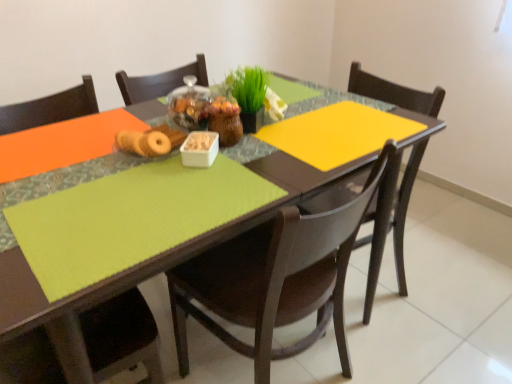
Question: Does white plastic container at center have a smaller size compared to green matte grass at center?

Choices:
 (A) yes
 (B) no

Answer: (A)

Question: Would you say white plastic container at center is outside green matte grass at center?

Choices:
 (A) yes
 (B) no

Answer: (A)

Question: Considering the relative sizes of white plastic container at center and green matte grass at center in the image provided, is white plastic container at center bigger than green matte grass at center?

Choices:
 (A) no
 (B) yes

Answer: (A)

Question: Considering the relative sizes of white plastic container at center and green matte grass at center in the image provided, is white plastic container at center thinner than green matte grass at center?

Choices:
 (A) yes
 (B) no

Answer: (A)

Question: From the image's perspective, does white plastic container at center appear lower than green matte grass at center?

Choices:
 (A) no
 (B) yes

Answer: (B)

Question: Is green matte grass at center in front of or behind lime green fabric table at center in the image?

Choices:
 (A) front
 (B) behind

Answer: (B)

Question: From the image's perspective, is green matte grass at center positioned above or below lime green fabric table at center?

Choices:
 (A) above
 (B) below

Answer: (A)

Question: Considering the positions of green matte grass at center and lime green fabric table at center in the image, is green matte grass at center taller or shorter than lime green fabric table at center?

Choices:
 (A) short
 (B) tall

Answer: (A)

Question: Do you think green matte grass at center is within lime green fabric table at center, or outside of it?

Choices:
 (A) inside
 (B) outside

Answer: (B)

Question: Is lime green fabric table at center in front of or behind white plastic container at center in the image?

Choices:
 (A) front
 (B) behind

Answer: (A)

Question: Is point (418, 144) positioned closer to the camera than point (202, 165)?

Choices:
 (A) farther
 (B) closer

Answer: (A)

Question: From the image's perspective, is lime green fabric table at center positioned above or below white plastic container at center?

Choices:
 (A) below
 (B) above

Answer: (A)

Question: Looking at their shapes, would you say lime green fabric table at center is wider or thinner than white plastic container at center?

Choices:
 (A) thin
 (B) wide

Answer: (B)

Question: Looking at their shapes, would you say green matte grass at center is wider or thinner than white plastic container at center?

Choices:
 (A) wide
 (B) thin

Answer: (A)

Question: Considering their positions, is green matte grass at center located in front of or behind white plastic container at center?

Choices:
 (A) front
 (B) behind

Answer: (B)